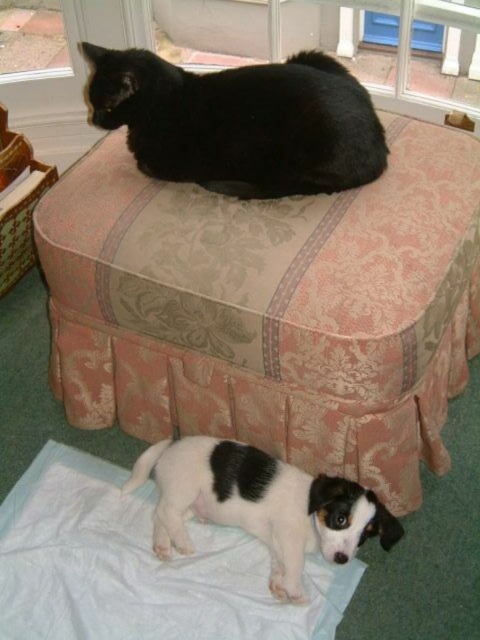
You are a toy mouse that is 10 cm tall. You want to jump from the floor to the pink damask ottoman at upper center where the black fur cat at upper center is sitting. Can you reach the top of the ottoman if you jump as high as you can?

The pink damask ottoman at upper center is taller than the black fur cat at upper center. Since the ottoman is taller than the cat, and the cat is sitting on it, the ottoman must be higher than 10 cm. Therefore, the toy mouse cannot reach the top of the ottoman with a 10 cm jump.